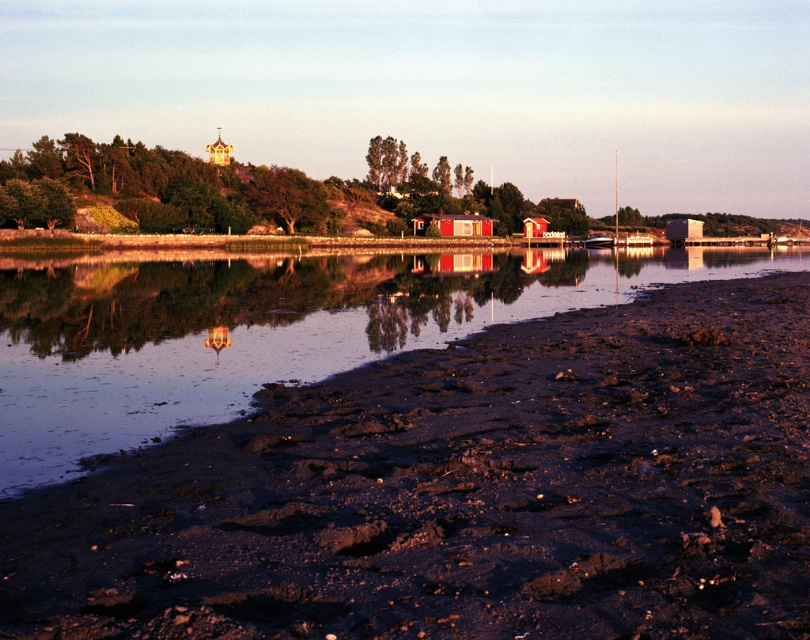
You are standing at the center of the beach and want to avoid stepping on the damp brown mud at lower left. Which direction should you move to stay away from it?

Since the damp brown mud at lower left is located at point (463, 492), you should move towards the upper right direction to stay away from it.

You are standing on the damp brown mud at lower left and want to reach the red wooden cabin at center. Which direction should you walk to get there?

You should walk towards the center, away from the lower left, since the red wooden cabin at center is farther from the viewer than the damp brown mud at lower left.

You are standing on the beach and want to walk towards the red wooden cabin at center. Which direction should you move to avoid the damp brown mud at lower left?

You should move to the right to avoid the damp brown mud at lower left, as it is located to the left of the red wooden cabin at center.